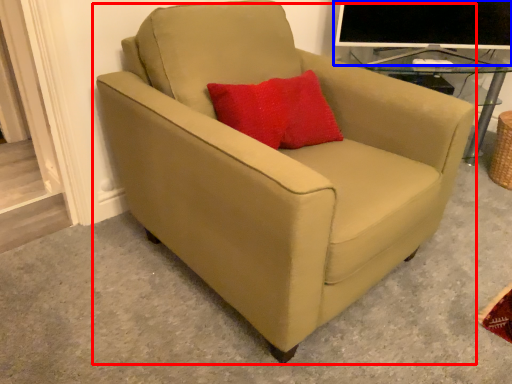
Question: Which object appears farthest to the camera in this image, chair (highlighted by a red box) or computer monitor (highlighted by a blue box)?

Choices:
 (A) chair
 (B) computer monitor

Answer: (B)